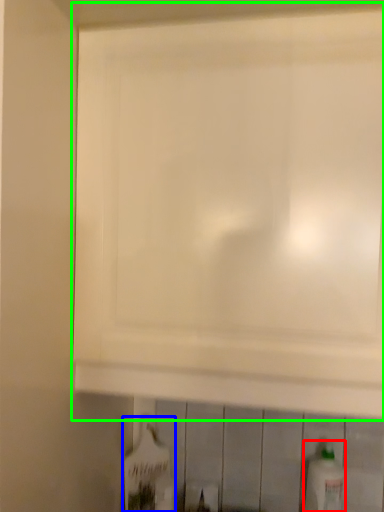
Question: Based on their relative distances, which object is nearer to bottle (highlighted by a red box)? Choose from bottle (highlighted by a blue box) and cabinetry (highlighted by a green box).

Choices:
 (A) bottle
 (B) cabinetry

Answer: (A)